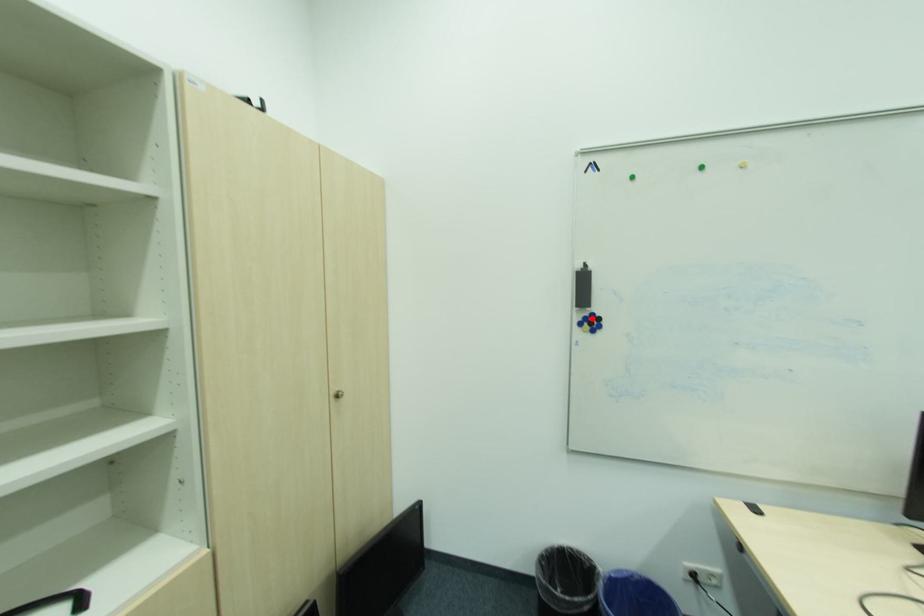
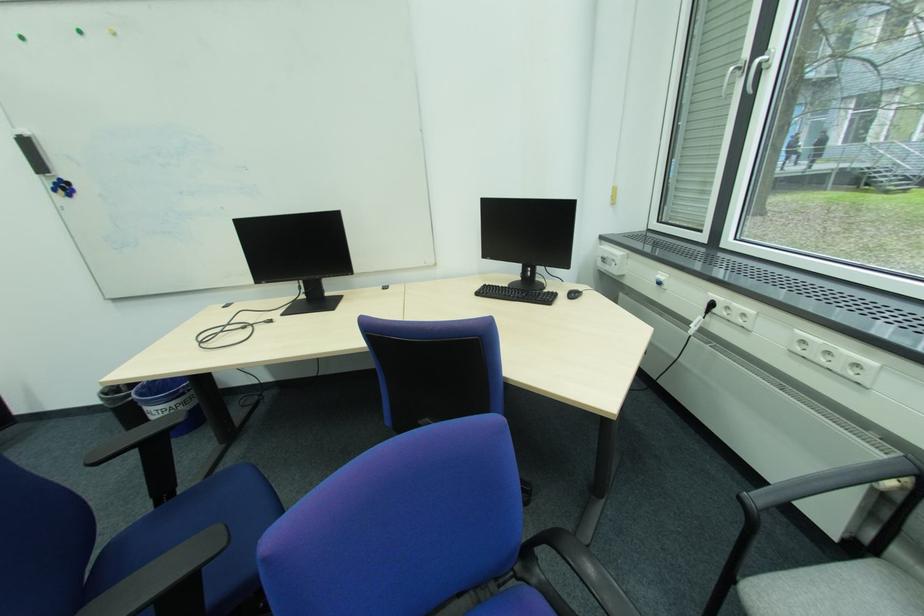
Question: I am providing you with two images of the same scene from different viewpoints. In image1, a red point is highlighted. Considering the same 3D point in image2, which of the following is correct?

Choices:
 (A) It is closer
 (B) It is farther

Answer: (B)